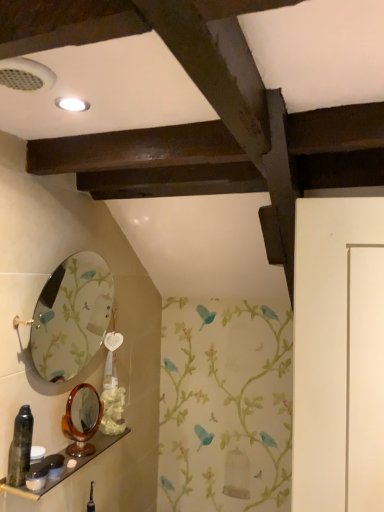
Question: From a real-world perspective, is wooden shelf at lower left below oval glass mirror at upper left, which is counted as the first mirror, starting from the top?

Choices:
 (A) no
 (B) yes

Answer: (B)

Question: From the image's perspective, would you say wooden shelf at lower left is shown under oval glass mirror at upper left, placed as the 2th mirror when sorted from bottom to top?

Choices:
 (A) no
 (B) yes

Answer: (B)

Question: Does wooden shelf at lower left have a lesser height compared to oval glass mirror at upper left, placed as the 2th mirror when sorted from bottom to top?

Choices:
 (A) yes
 (B) no

Answer: (A)

Question: Is wooden shelf at lower left further to the viewer compared to oval glass mirror at upper left, placed as the 2th mirror when sorted from bottom to top?

Choices:
 (A) yes
 (B) no

Answer: (B)

Question: Could you tell me if wooden shelf at lower left is turned towards oval glass mirror at upper left, which is counted as the first mirror, starting from the top?

Choices:
 (A) yes
 (B) no

Answer: (B)

Question: Does wooden shelf at lower left have a smaller size compared to oval glass mirror at upper left, placed as the 2th mirror when sorted from bottom to top?

Choices:
 (A) yes
 (B) no

Answer: (A)

Question: Is matte black spray can at lower left facing away from matte black container at lower left?

Choices:
 (A) yes
 (B) no

Answer: (B)

Question: From the image's perspective, is matte black spray can at lower left located beneath matte black container at lower left?

Choices:
 (A) no
 (B) yes

Answer: (A)

Question: Is matte black container at lower left located within matte black spray can at lower left?

Choices:
 (A) yes
 (B) no

Answer: (B)

Question: Is matte black spray can at lower left facing towards matte black container at lower left?

Choices:
 (A) no
 (B) yes

Answer: (A)

Question: Does matte black spray can at lower left have a greater height compared to matte black container at lower left?

Choices:
 (A) yes
 (B) no

Answer: (A)

Question: Can you confirm if matte black spray can at lower left is positioned to the right of matte black container at lower left?

Choices:
 (A) yes
 (B) no

Answer: (B)

Question: Is wooden shelf at lower left outside matte black container at lower left?

Choices:
 (A) yes
 (B) no

Answer: (A)